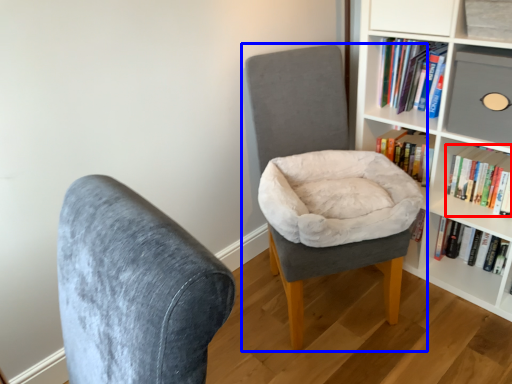
Question: Which of the following is the farthest to the observer, book (highlighted by a red box) or chair (highlighted by a blue box)?

Choices:
 (A) book
 (B) chair

Answer: (A)